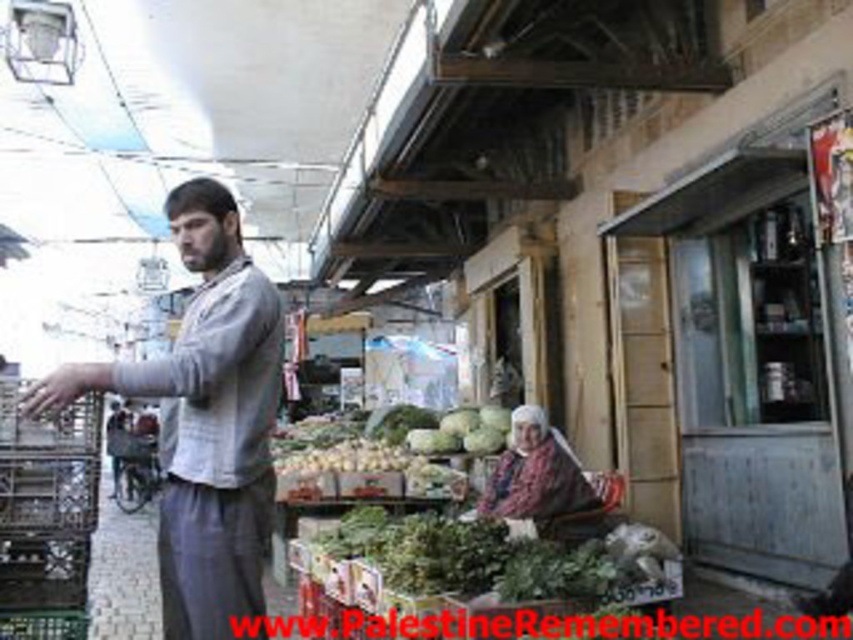
You are a delivery person who needs to place a new crate at the exact location of point [45,515]. However, there is already an object there. What is it?

The brown plastic crate at left is already at point [45,515].

You are a customer at the market and want to buy both the gray cotton shirt at center and the green matte cabbage at center. Which item is closer to you?

The gray cotton shirt at center is closer to you since it is in front of the green matte cabbage at center.